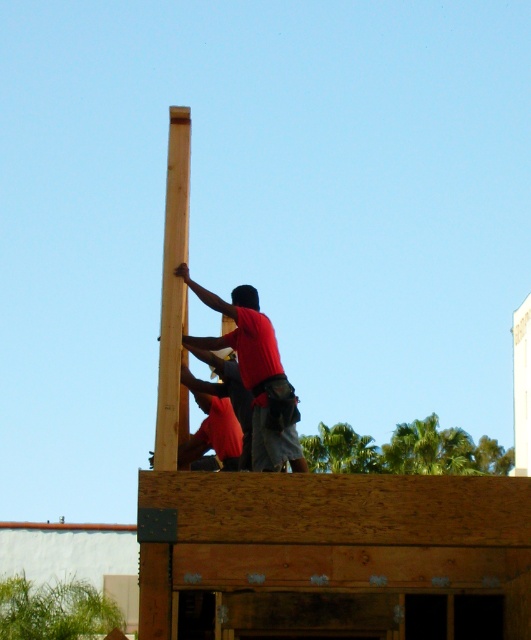
You are a safety inspector observing the construction site. You notice the light brown wood at center and the red shirt at center. Based on their positions, which object is higher in the image?

The light brown wood at center is above the red shirt at center, so it is higher in the image.

You are a safety inspector observing the construction site. You notice the light brown wood at center and the red shirt at center. Which object is closer to you in the image?

The light brown wood at center is closer to you because it is in front of the red shirt at center.

Consider the image. You are a safety inspector checking the construction site. You notice the light brown wood at center and the red shirt at center. Which object should you prioritize inspecting for safety concerns based on their size?

The light brown wood at center is larger in size than the red shirt at center, so you should prioritize inspecting the light brown wood at center for safety concerns because larger objects pose greater risks if they fall or shift during construction.